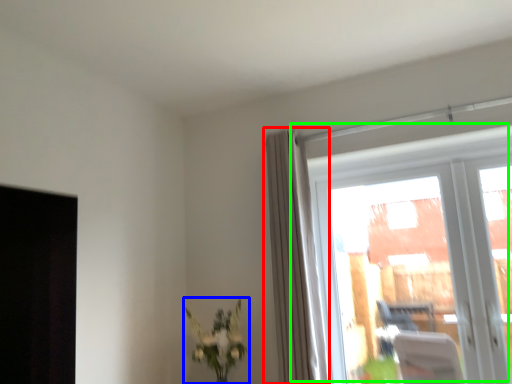
Question: Which object is positioned closest to curtain (highlighted by a red box)? Select from houseplant (highlighted by a blue box) and window (highlighted by a green box).

Choices:
 (A) houseplant
 (B) window

Answer: (A)